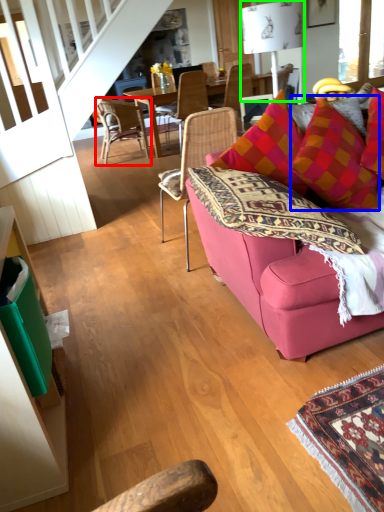
Question: Considering the real-world distances, which object is farthest from chair (highlighted by a red box)? throw pillow (highlighted by a blue box) or lamp (highlighted by a green box)?

Choices:
 (A) throw pillow
 (B) lamp

Answer: (A)